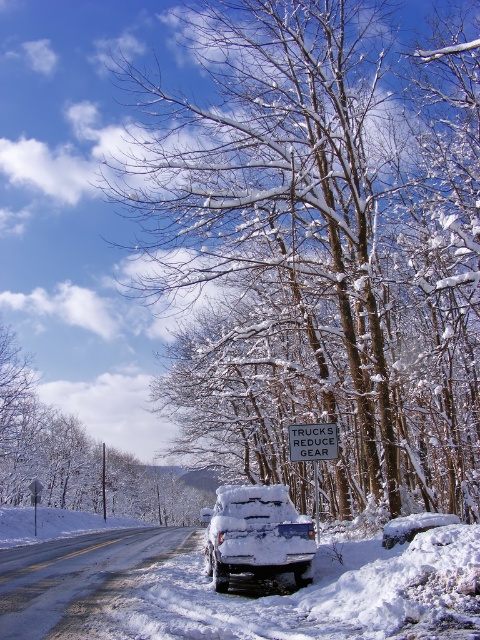
Is snow-covered branches at upper center shorter than white plastic sign at upper center?

No, snow-covered branches at upper center is not shorter than white plastic sign at upper center.

Which is in front, point (143, 104) or point (36, 490)?

Point (143, 104) is in front.

Which is behind, point (365, 24) or point (36, 484)?

Point (36, 484)

The image size is (480, 640). Find the location of `snow-covered branches at upper center`. snow-covered branches at upper center is located at coordinates (321, 248).

Is white fluffy snow at center positioned behind white plastic sign at upper center?

No.

Between point (184, 538) and point (38, 484), which one is positioned in front?

Point (38, 484) is more forward.

Find the location of `white fluffy snow at center`. white fluffy snow at center is located at coordinates (239, 589).

Does snow-covered branches at upper center have a larger size compared to white fluffy snow at center?

Yes.

Which is in front, point (346, 29) or point (36, 604)?

Point (36, 604) is in front.

Locate an element on the screen. This screenshot has height=640, width=480. snow-covered branches at upper center is located at coordinates (321, 248).